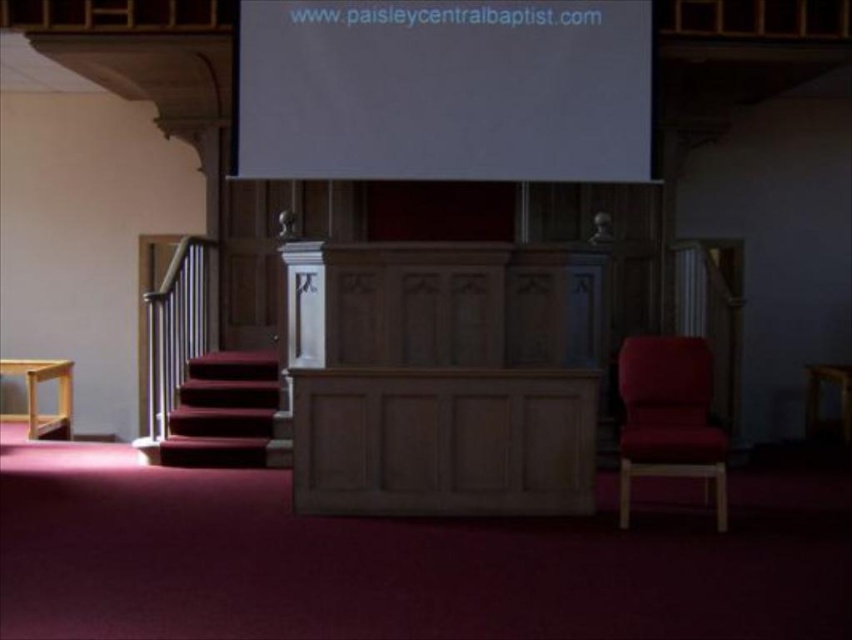
Question: Can you confirm if white matte projection screen at upper center is positioned to the right of velvet red carpet at lower left?

Choices:
 (A) yes
 (B) no

Answer: (A)

Question: Which point is farther from the camera taking this photo?

Choices:
 (A) (626, 141)
 (B) (683, 458)
 (C) (219, 444)

Answer: (A)

Question: Which is farther from the velvet red armchair at right?

Choices:
 (A) white matte projection screen at upper center
 (B) velvet red carpet at lower left

Answer: (B)

Question: Does white matte projection screen at upper center appear on the left side of velvet red carpet at lower left?

Choices:
 (A) yes
 (B) no

Answer: (B)

Question: Which point is farther to the camera?

Choices:
 (A) (281, 132)
 (B) (674, 355)

Answer: (A)

Question: Can you confirm if velvet red armchair at right is positioned below velvet red carpet at lower left?

Choices:
 (A) no
 (B) yes

Answer: (A)